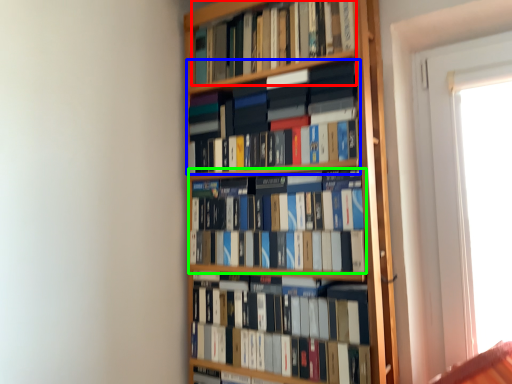
Question: Based on their relative distances, which object is nearer to book (highlighted by a red box)? Choose from book (highlighted by a blue box) and book (highlighted by a green box).

Choices:
 (A) book
 (B) book

Answer: (A)